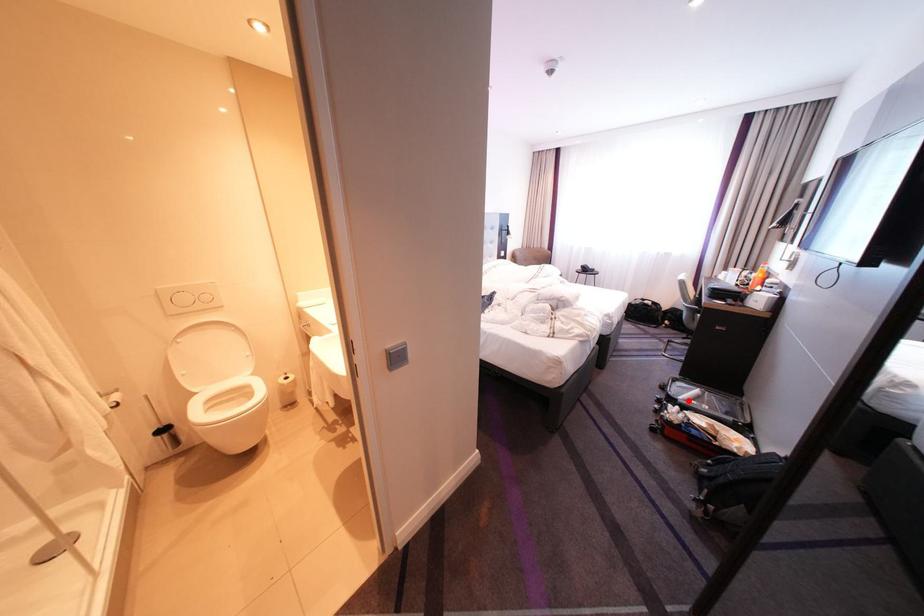
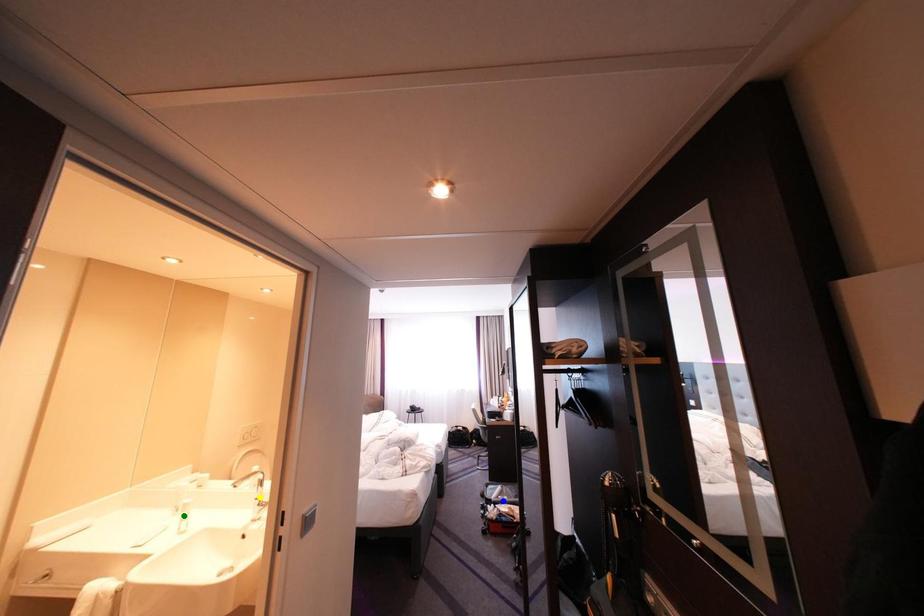
Question: I am providing you with two images of the same scene from different viewpoints. A red point is marked on the first image. You are given multiple points on the second image. In image 2, which mark is for the same physical point as the one in image 1?

Choices:
 (A) yellow point
 (B) green point
 (C) blue point

Answer: (C)